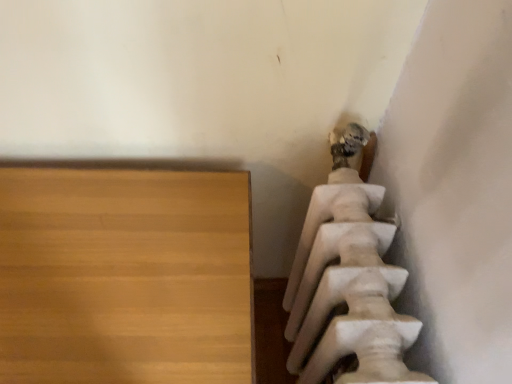
Question: Is point (182, 173) closer or farther from the camera than point (297, 299)?

Choices:
 (A) farther
 (B) closer

Answer: (B)

Question: Relative to white marble statue at upper right, is light brown wood table at lower left in front or behind?

Choices:
 (A) front
 (B) behind

Answer: (B)

Question: From the image's perspective, is light brown wood table at lower left located above or below white marble statue at upper right?

Choices:
 (A) below
 (B) above

Answer: (A)

Question: From the image's perspective, relative to light brown wood table at lower left, is white marble statue at upper right above or below?

Choices:
 (A) below
 (B) above

Answer: (B)

Question: From their relative heights in the image, would you say white marble statue at upper right is taller or shorter than light brown wood table at lower left?

Choices:
 (A) short
 (B) tall

Answer: (A)

Question: Relative to light brown wood table at lower left, is white marble statue at upper right in front or behind?

Choices:
 (A) behind
 (B) front

Answer: (B)

Question: In terms of size, does white marble statue at upper right appear bigger or smaller than light brown wood table at lower left?

Choices:
 (A) big
 (B) small

Answer: (B)